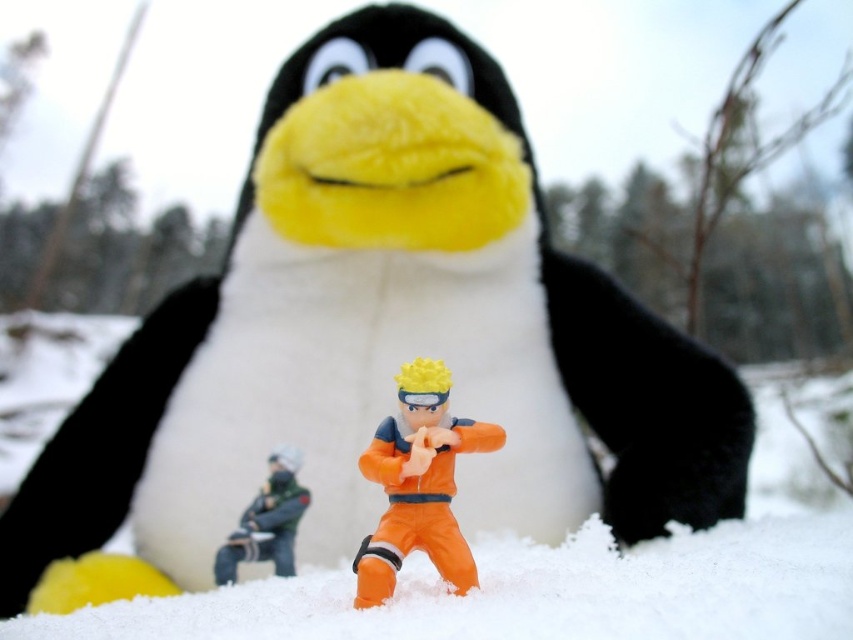
You are standing in the snowy scene and want to place a small gift exactly halfway between the two points labeled point (x=398, y=506) and point (x=271, y=541). Will the gift be closer to the penguin or the orange figurine?

The gift placed halfway between point (x=398, y=506) and point (x=271, y=541) will be closer to the orange figurine because point (x=398, y=506) is in front of point (x=271, y=541), meaning the orange figurine is closer to the penguin and the halfway point would still be nearer to it.

You are a photographer standing at the camera position. You want to take a closeup photo of the orange matte toy at center. Can you reach it without moving your feet? The camera has a maximum zoom of 100mm.

The orange matte toy at center is 29.37 inches away from the camera. Since the camera can zoom up to 100mm, which allows focusing on objects at that distance, you can take the closeup without moving your feet.

You are organizing a display for a toy store and need to arrange the orange matte toy at center and the orange plastic toy at center on a shelf. Which toy should you place on the lower shelf if you want the taller one to be more visible from above?

The orange matte toy at center is taller than the orange plastic toy at center, so place the orange matte toy at center on the lower shelf to make it more visible from above.